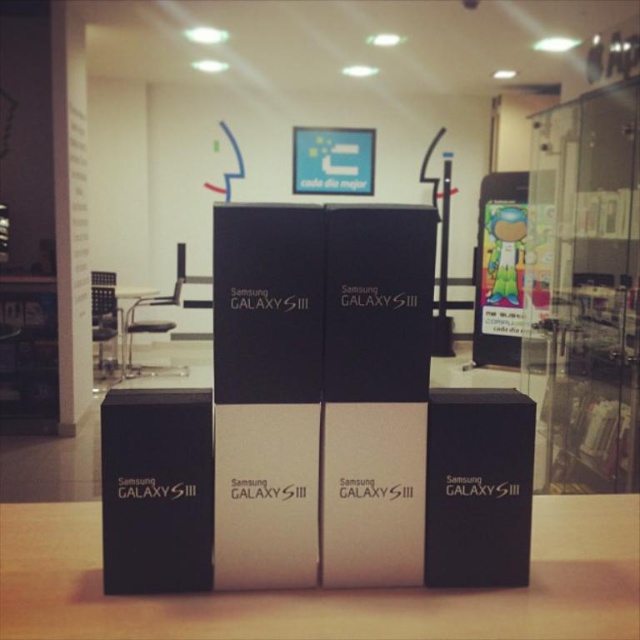
Question: Which point is farther from the camera taking this photo?

Choices:
 (A) (108, 330)
 (B) (518, 612)

Answer: (A)

Question: Does black matte galaxy s iii boxes at center have a larger size compared to metallic silver table at left?

Choices:
 (A) yes
 (B) no

Answer: (B)

Question: Among these points, which one is farthest from the camera?

Choices:
 (A) pos(122,348)
 (B) pos(614,568)

Answer: (A)

Question: Can you confirm if black matte galaxy s iii boxes at center is smaller than metallic silver table at left?

Choices:
 (A) no
 (B) yes

Answer: (B)

Question: Is black matte galaxy s iii boxes at center to the right of metallic silver table at left from the viewer's perspective?

Choices:
 (A) no
 (B) yes

Answer: (B)